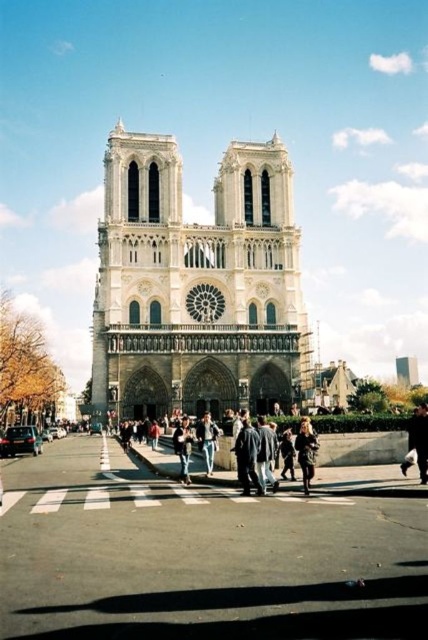
Does dark brown leather jacket at center have a larger size compared to denim jacket at center?

No.

Is dark brown leather jacket at center to the right of denim jacket at center from the viewer's perspective?

Correct, you'll find dark brown leather jacket at center to the right of denim jacket at center.

Is point (300, 436) farther from viewer compared to point (189, 440)?

Yes, it is.

What are the coordinates of `dark brown leather jacket at center` in the screenshot? It's located at (306, 452).

Between dark brown leather jacket at lower right and shiny black sedan at lower left, which one appears on the left side from the viewer's perspective?

shiny black sedan at lower left

Who is positioned more to the right, dark brown leather jacket at lower right or shiny black sedan at lower left?

Positioned to the right is dark brown leather jacket at lower right.

Where is `dark brown leather jacket at lower right`? The height and width of the screenshot is (640, 428). dark brown leather jacket at lower right is located at coordinates (419, 440).

Who is lower down, dark brown leather jacket at lower right or dark brown leather jacket at center?

dark brown leather jacket at center is lower down.

Between dark brown leather jacket at lower right and dark brown leather jacket at center, which one has more height?

dark brown leather jacket at lower right

Which is behind, point (424, 460) or point (300, 426)?

Point (300, 426)

Where is `dark brown leather jacket at lower right`? Image resolution: width=428 pixels, height=640 pixels. dark brown leather jacket at lower right is located at coordinates pos(419,440).